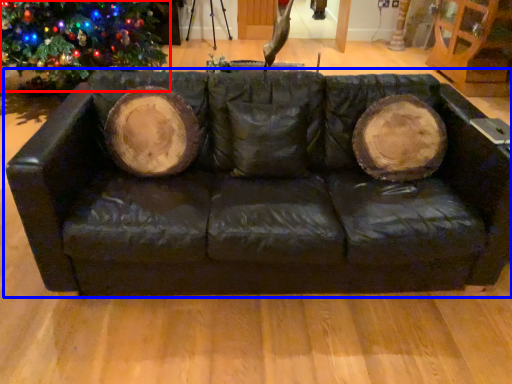
Question: Which of the following is the farthest to the observer, christmas tree (highlighted by a red box) or studio couch (highlighted by a blue box)?

Choices:
 (A) christmas tree
 (B) studio couch

Answer: (A)